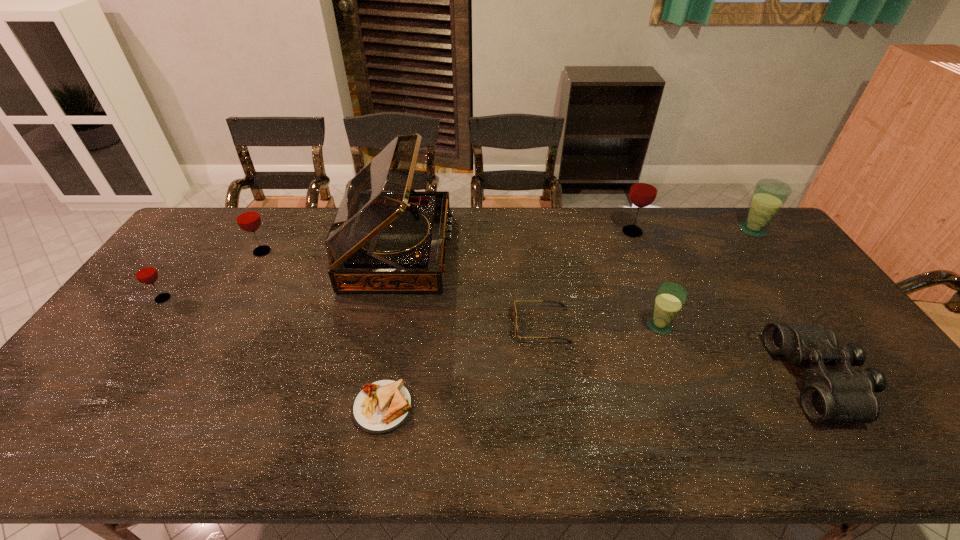
At what (x,y) coordinates should I click in order to perform the action: click on the tallest object. Please return your answer as a coordinate pair (x, y). Looking at the image, I should click on (385, 237).

Where is `the tallest glass`? the tallest glass is located at coordinates (644, 189).

You are a GUI agent. You are given a task and a screenshot of the screen. Output one action in this format:
    pyautogui.click(x=<x>, y=<y>)
    Task: Click on the second tallest object
    This screenshot has height=540, width=960.
    Given the screenshot: What is the action you would take?
    pyautogui.click(x=644, y=189)

Image resolution: width=960 pixels, height=540 pixels. Identify the location of the rightmost glass. (769, 195).

Where is `the bigger blue glass`? The width and height of the screenshot is (960, 540). the bigger blue glass is located at coordinates (769, 195).

Where is `the second red glass from left to right`? The height and width of the screenshot is (540, 960). the second red glass from left to right is located at coordinates (247, 217).

The image size is (960, 540). What are the coordinates of `the third nearest glass` in the screenshot? It's located at (247, 217).

I want to click on the smallest red glass, so click(143, 270).

Where is `the leftmost glass`? the leftmost glass is located at coordinates (143, 270).

At what (x,y) coordinates should I click in order to perform the action: click on the left blue glass. Please return your answer as a coordinate pair (x, y). Image resolution: width=960 pixels, height=540 pixels. Looking at the image, I should click on (670, 298).